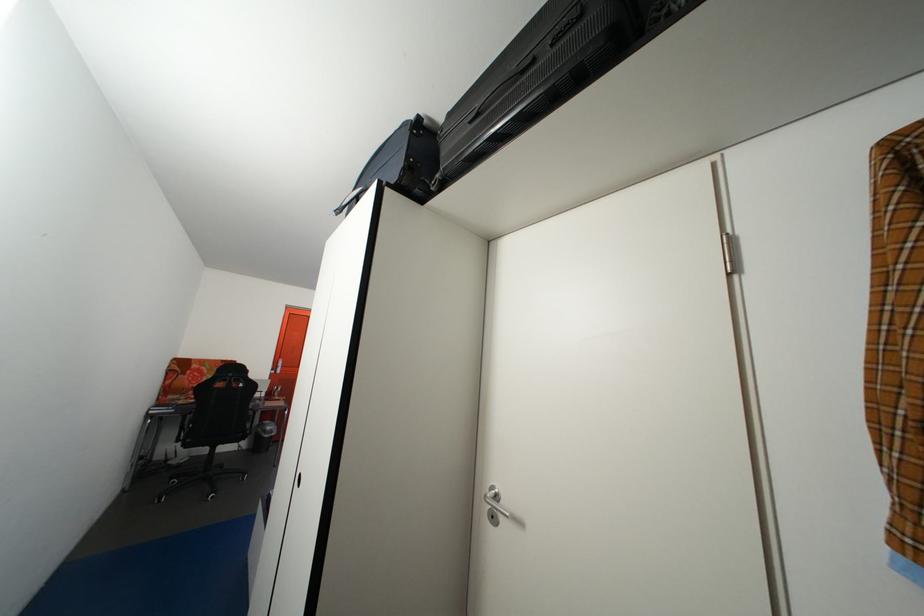
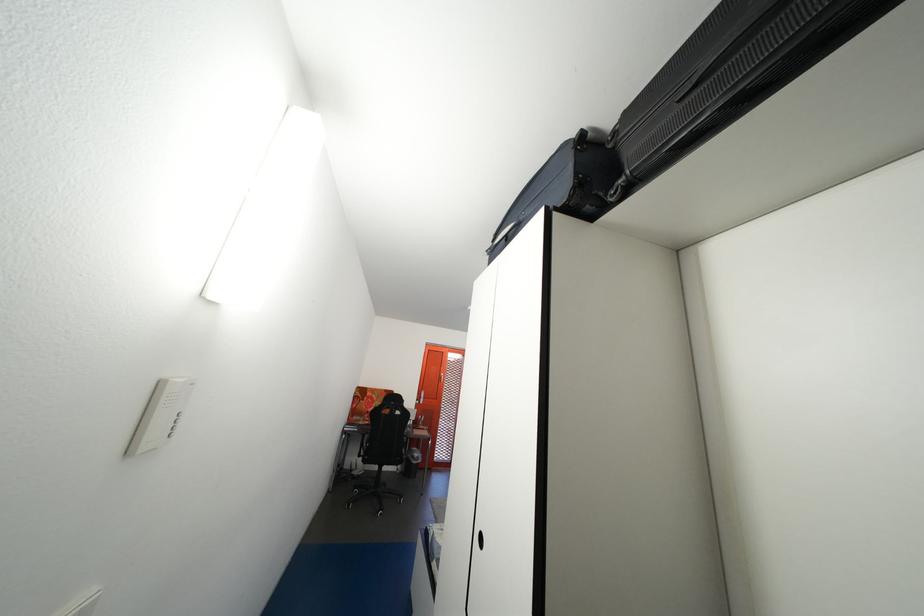
Question: How did the camera likely rotate?

Choices:
 (A) Left
 (B) Right
 (C) Up
 (D) Down

Answer: (A)